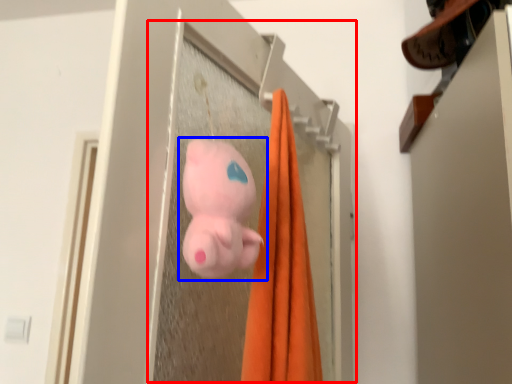
Question: Which of the following is the farthest to the observer, screen door (highlighted by a red box) or toy (highlighted by a blue box)?

Choices:
 (A) screen door
 (B) toy

Answer: (A)